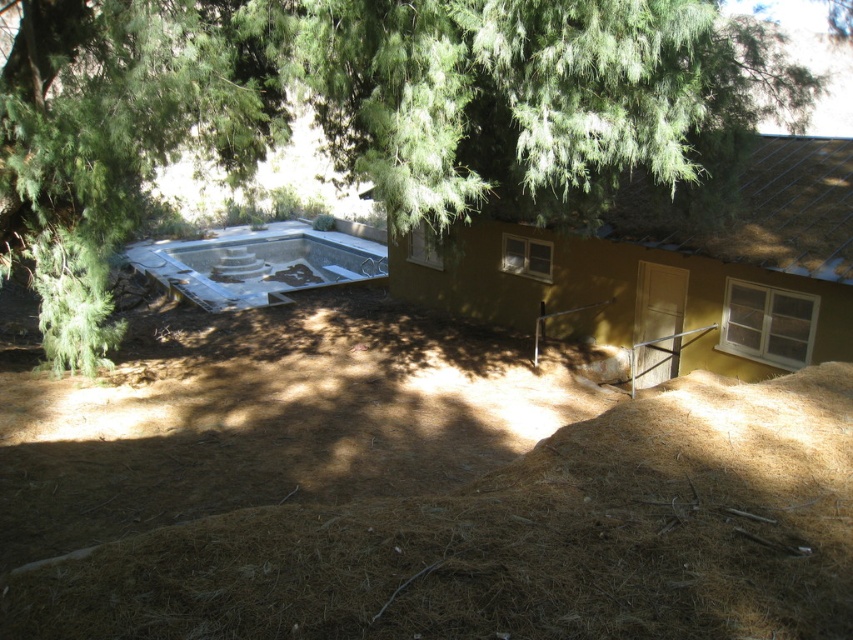
Who is positioned more to the right, green leafy tree at upper center or brown dry hay at lower center?

Positioned to the right is brown dry hay at lower center.

Does green leafy tree at upper center appear under brown dry hay at lower center?

Actually, green leafy tree at upper center is above brown dry hay at lower center.

Between point (508, 152) and point (547, 518), which one is positioned behind?

The point (508, 152) is more distant.

Image resolution: width=853 pixels, height=640 pixels. In order to click on green leafy tree at upper center in this screenshot , I will do [374, 104].